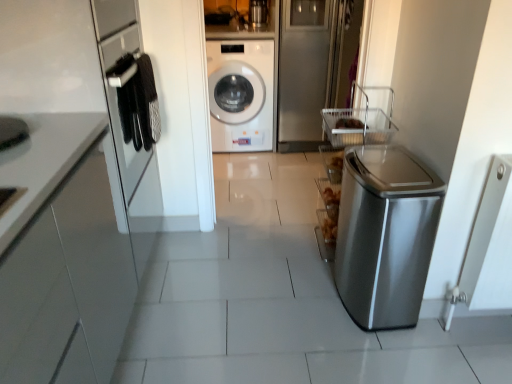
What do you see at coordinates (241, 94) in the screenshot? I see `white glossy washing machine at center` at bounding box center [241, 94].

The width and height of the screenshot is (512, 384). I want to click on clear glass door at upper center, so click(x=304, y=71).

How many degrees apart are the facing directions of satin silver trash can at right and clear glass door at upper center?

There is a 88.5-degree angle between the facing directions of satin silver trash can at right and clear glass door at upper center.

Consider the image. From a real-world perspective, who is located higher, satin silver trash can at right or clear glass door at upper center?

From a 3D spatial view, clear glass door at upper center is above.

Is satin silver trash can at right inside or outside of clear glass door at upper center?

satin silver trash can at right lies outside clear glass door at upper center.

Is satin silver trash can at right in front of clear glass door at upper center?

Yes, satin silver trash can at right is closer to the camera.

Which of these two, clear glass door at upper center or brushed metal washing machine at upper center, stands shorter?

With less height is brushed metal washing machine at upper center.

From a real-world perspective, is clear glass door at upper center positioned over brushed metal washing machine at upper center based on gravity?

No, from a real-world perspective, clear glass door at upper center is not above brushed metal washing machine at upper center.

From the image's perspective, relative to brushed metal washing machine at upper center, is clear glass door at upper center above or below?

Based on their image positions, clear glass door at upper center is located beneath brushed metal washing machine at upper center.

Consider the image. Which object is further away from the camera taking this photo, brushed metal washing machine at upper center or white glossy washing machine at center?

brushed metal washing machine at upper center is more distant.

From a real-world perspective, is brushed metal washing machine at upper center on white glossy washing machine at center?

Yes.

Based on the photo, is brushed metal washing machine at upper center positioned beyond the bounds of white glossy washing machine at center?

Yes, brushed metal washing machine at upper center is located beyond the bounds of white glossy washing machine at center.

Considering the sizes of objects clear glass door at upper center and white glossy washing machine at center in the image provided, who is thinner, clear glass door at upper center or white glossy washing machine at center?

clear glass door at upper center is thinner.

Can you see clear glass door at upper center touching white glossy washing machine at center?

No, clear glass door at upper center is not making contact with white glossy washing machine at center.

Is clear glass door at upper center surrounding white glossy washing machine at center?

Actually, white glossy washing machine at center is outside clear glass door at upper center.

From the image's perspective, between brushed metal washing machine at upper center and satin silver trash can at right, which one is located above?

brushed metal washing machine at upper center, from the image's perspective.

I want to click on appliance above the satin silver trash can at right (from the image's perspective), so click(x=258, y=13).

Choose the correct answer: Is brushed metal washing machine at upper center inside satin silver trash can at right or outside it?

brushed metal washing machine at upper center is located beyond the bounds of satin silver trash can at right.

Who is more distant, white glossy washing machine at center or satin silver trash can at right?

white glossy washing machine at center is more distant.

From the image's perspective, is white glossy washing machine at center above or below satin silver trash can at right?

Clearly, from the image's perspective, white glossy washing machine at center is above satin silver trash can at right.

How many degrees apart are the facing directions of white glossy washing machine at center and satin silver trash can at right?

88.5 degrees separate the facing orientations of white glossy washing machine at center and satin silver trash can at right.

Looking at this image, from the image's perspective, is satin silver trash can at right on white glossy washing machine at center?

No, from the image's perspective, satin silver trash can at right is not on top of white glossy washing machine at center.

Is satin silver trash can at right shorter than white glossy washing machine at center?

Yes.

From a real-world perspective, is satin silver trash can at right on white glossy washing machine at center?

No, from a real-world perspective, satin silver trash can at right is not on top of white glossy washing machine at center.

Locate an element on the screen. Image resolution: width=512 pixels, height=384 pixels. dish washer below the clear glass door at upper center (from the image's perspective) is located at coordinates (385, 235).

The width and height of the screenshot is (512, 384). I want to click on glass door beneath the brushed metal washing machine at upper center (from a real-world perspective), so click(x=304, y=71).

Which object lies nearer to the anchor point satin silver trash can at right, clear glass door at upper center or brushed metal washing machine at upper center?

clear glass door at upper center lies closer to satin silver trash can at right than the other object.

Which object lies nearer to the anchor point satin silver trash can at right, clear glass door at upper center or white glossy washing machine at center?

Among the two, clear glass door at upper center is located nearer to satin silver trash can at right.

Looking at the image, which one is located closer to white glossy washing machine at center, brushed metal washing machine at upper center or satin silver trash can at right?

brushed metal washing machine at upper center.

Based on their spatial positions, is satin silver trash can at right or brushed metal washing machine at upper center further from white glossy washing machine at center?

satin silver trash can at right is further to white glossy washing machine at center.

From the image, which object appears to be farther from brushed metal washing machine at upper center, clear glass door at upper center or white glossy washing machine at center?

white glossy washing machine at center.

Considering their positions, is white glossy washing machine at center positioned further to brushed metal washing machine at upper center than satin silver trash can at right?

satin silver trash can at right is positioned further to the anchor brushed metal washing machine at upper center.

From the image, which object appears to be nearer to brushed metal washing machine at upper center, white glossy washing machine at center or clear glass door at upper center?

clear glass door at upper center is closer to brushed metal washing machine at upper center.

Estimate the real-world distances between objects in this image. Which object is further from clear glass door at upper center, white glossy washing machine at center or satin silver trash can at right?

Among the two, satin silver trash can at right is located further to clear glass door at upper center.

Identify the location of glass door positioned between satin silver trash can at right and brushed metal washing machine at upper center from near to far. (304, 71).

Identify the location of washing machine between satin silver trash can at right and brushed metal washing machine at upper center in the front-back direction. (241, 94).

Where is `glass door between satin silver trash can at right and white glossy washing machine at center in the front-back direction`? This screenshot has height=384, width=512. glass door between satin silver trash can at right and white glossy washing machine at center in the front-back direction is located at coordinates [x=304, y=71].

The height and width of the screenshot is (384, 512). In order to click on appliance between white glossy washing machine at center and clear glass door at upper center in the horizontal direction in this screenshot , I will do `click(258, 13)`.